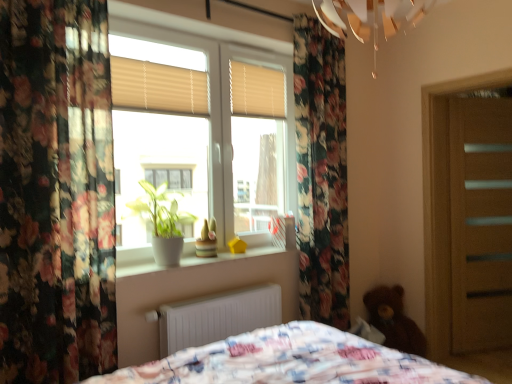
Question: Does brown plush teddy bear at lower right come behind beige/wooden blinds at upper center, the second shutter from the left?

Choices:
 (A) yes
 (B) no

Answer: (A)

Question: Is brown plush teddy bear at lower right to the left of beige/wooden blinds at upper center, the second shutter from the left, from the viewer's perspective?

Choices:
 (A) yes
 (B) no

Answer: (B)

Question: Does brown plush teddy bear at lower right have a lesser height compared to beige/wooden blinds at upper center, arranged as the second shutter when viewed from the front?

Choices:
 (A) no
 (B) yes

Answer: (A)

Question: Is brown plush teddy bear at lower right wider than beige/wooden blinds at upper center, the second shutter from the left?

Choices:
 (A) yes
 (B) no

Answer: (A)

Question: Is beige/wooden blinds at upper center, the 1th shutter from the right, completely or partially inside brown plush teddy bear at lower right?

Choices:
 (A) no
 (B) yes

Answer: (A)

Question: Is point (245, 77) closer or farther from the camera than point (244, 67)?

Choices:
 (A) farther
 (B) closer

Answer: (A)

Question: Is beige/wooden blinds at upper center, the 1th shutter from the right, bigger or smaller than white plastic window at center?

Choices:
 (A) small
 (B) big

Answer: (A)

Question: From the image's perspective, relative to white plastic window at center, is beige/wooden blinds at upper center, the 1th shutter from the right, above or below?

Choices:
 (A) above
 (B) below

Answer: (A)

Question: Is beige/wooden blinds at upper center, arranged as the second shutter when viewed from the front, situated inside white plastic window at center or outside?

Choices:
 (A) outside
 (B) inside

Answer: (B)

Question: Is white plastic window at center in front of or behind brown plush teddy bear at lower right in the image?

Choices:
 (A) behind
 (B) front

Answer: (B)

Question: Considering the relative positions of white plastic window at center and brown plush teddy bear at lower right in the image provided, is white plastic window at center to the left or to the right of brown plush teddy bear at lower right?

Choices:
 (A) right
 (B) left

Answer: (B)

Question: Is white plastic window at center situated inside brown plush teddy bear at lower right or outside?

Choices:
 (A) inside
 (B) outside

Answer: (B)

Question: In terms of size, does white plastic window at center appear bigger or smaller than brown plush teddy bear at lower right?

Choices:
 (A) small
 (B) big

Answer: (B)

Question: Is white plastic window at center to the left or to the right of floral fabric curtain at left in the image?

Choices:
 (A) left
 (B) right

Answer: (B)

Question: In terms of size, does white plastic window at center appear bigger or smaller than floral fabric curtain at left?

Choices:
 (A) small
 (B) big

Answer: (A)